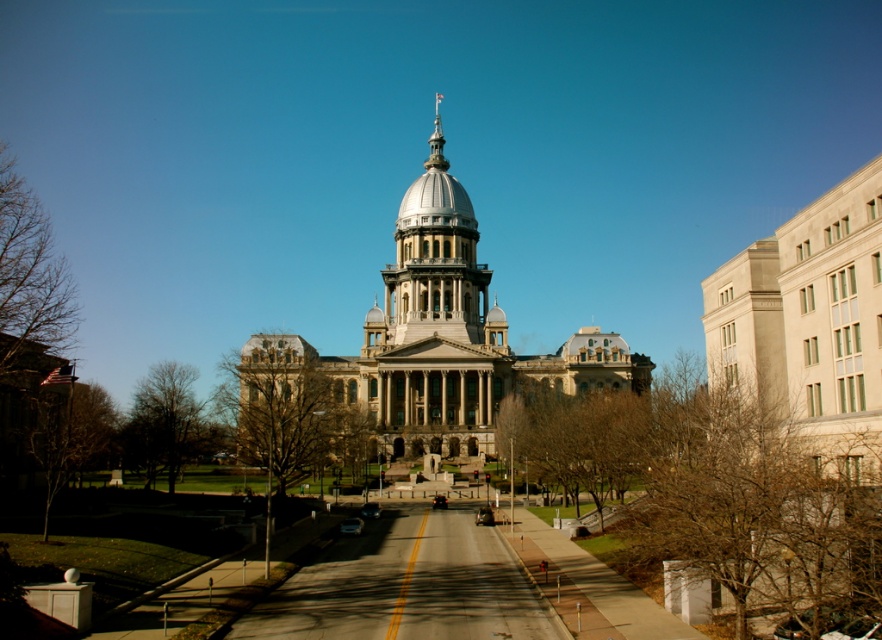
You are standing in front of the grand neoclassical building and notice two points marked on the facade. The first point is at coordinates point (434, 173) and the second is at point (434, 132). Which of these two points is nearer to your current position?

Point (434, 173) is closer to the camera than point (434, 132), so the first point is nearer to your current position.

You are an architect analyzing the proportions of the building. Which object, the white marble dome at center or the polished silver spire at center top, is shorter in height?

The white marble dome at center is shorter in height compared to the polished silver spire at center top.